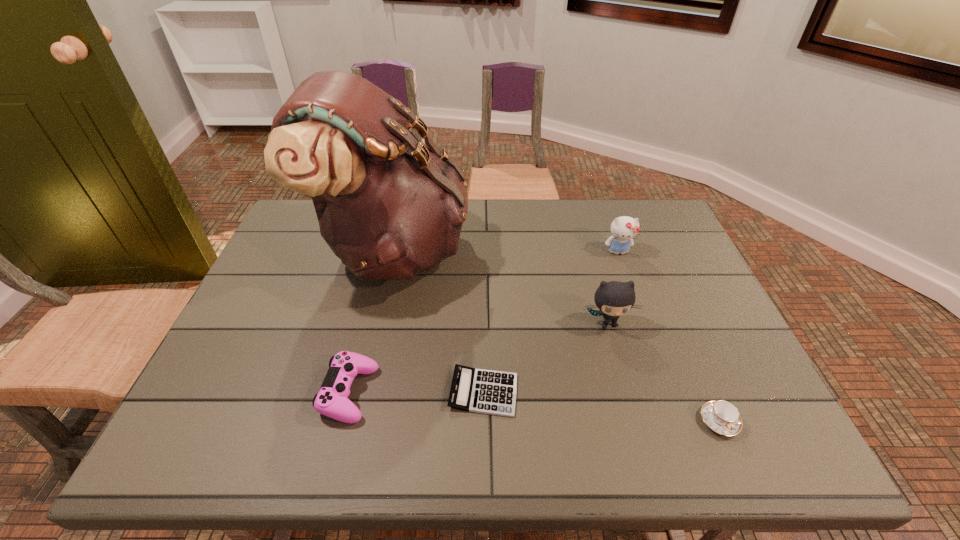
You are a GUI agent. You are given a task and a screenshot of the screen. Output one action in this format:
    pyautogui.click(x=<x>, y=<y>)
    Task: Click on the satchel
    Image resolution: width=960 pixels, height=540 pixels.
    Given the screenshot: What is the action you would take?
    pyautogui.click(x=388, y=206)

The height and width of the screenshot is (540, 960). Identify the location of the nearer kitten. [614, 298].

Locate an element on the screen. the farther kitten is located at coordinates (624, 229).

This screenshot has height=540, width=960. I want to click on control, so click(331, 401).

The width and height of the screenshot is (960, 540). I want to click on the fifth tallest object, so click(721, 416).

Locate an element on the screen. the rightmost object is located at coordinates (721, 416).

The image size is (960, 540). I want to click on calculator, so click(483, 391).

I want to click on vacant space located 0.370m at the front of the satchel with buckles, so click(x=591, y=250).

Identify the location of free space located on the front-facing side of the nearer kitten. This screenshot has width=960, height=540. (632, 411).

Image resolution: width=960 pixels, height=540 pixels. Identify the location of blank space located 0.290m on the front-facing side of the farther kitten. (648, 336).